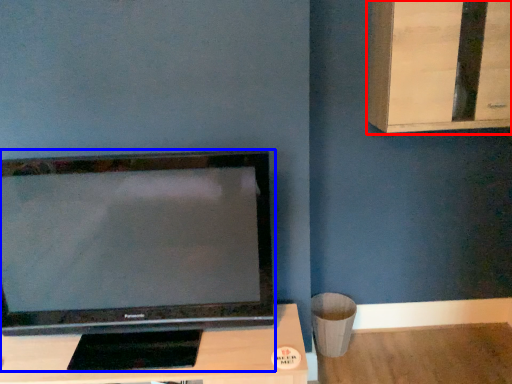
Question: Which object is closer to the camera taking this photo, dresser (highlighted by a red box) or television (highlighted by a blue box)?

Choices:
 (A) dresser
 (B) television

Answer: (B)